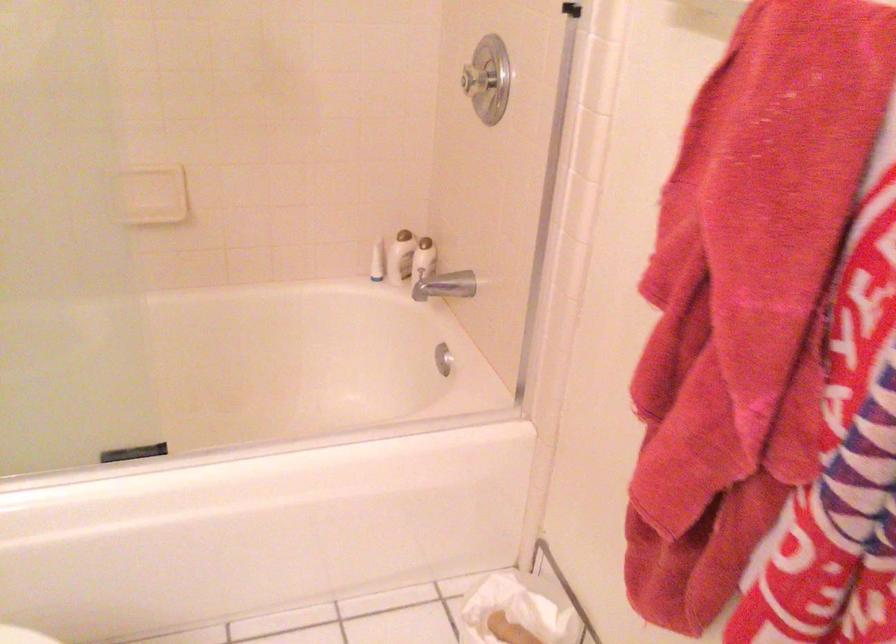
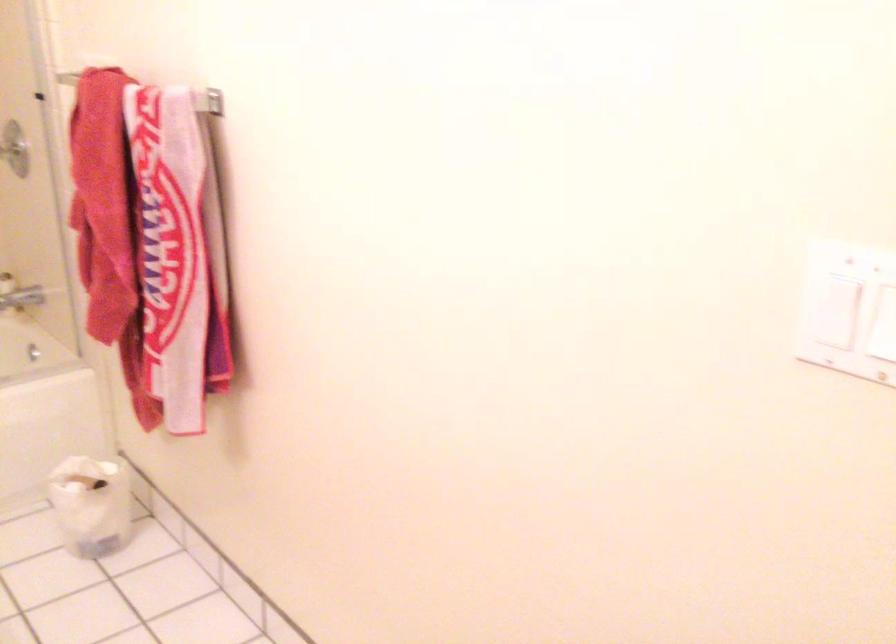
Find the pixel in the second image that matches (442,292) in the first image.

(20, 299)